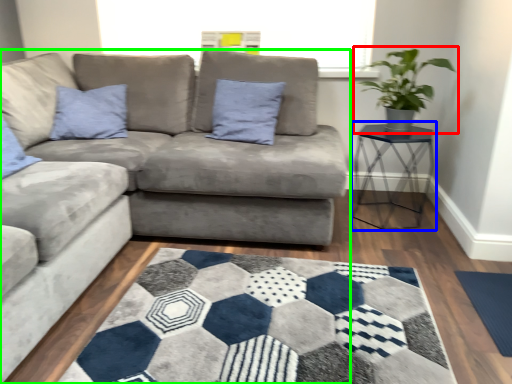
Question: Which is farther away from houseplant (highlighted by a red box)? table (highlighted by a blue box) or studio couch (highlighted by a green box)?

Choices:
 (A) table
 (B) studio couch

Answer: (B)